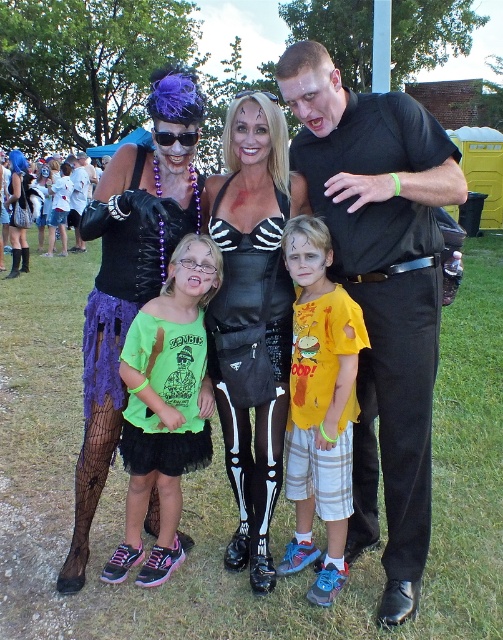
Question: Does neon green t-shirt at center have a greater width compared to yellow cotton shirt at center?

Choices:
 (A) yes
 (B) no

Answer: (A)

Question: Can you confirm if black leather dress at center is positioned below matte purple wig at upper left?

Choices:
 (A) yes
 (B) no

Answer: (A)

Question: Can you confirm if yellow cotton shirt at center is positioned above matte purple wig at upper left?

Choices:
 (A) yes
 (B) no

Answer: (B)

Question: Which point is farther from the camera taking this photo?

Choices:
 (A) (433, 161)
 (B) (176, 468)
 (C) (13, 259)
 (D) (174, 125)

Answer: (C)

Question: Estimate the real-world distances between objects in this image. Which object is farther from the matte black lace gloves at upper left?

Choices:
 (A) black matte shirt at center
 (B) yellow cotton shirt at center

Answer: (A)

Question: Which point is farther from the camera taking this photo?

Choices:
 (A) (41, 211)
 (B) (142, 186)
 (C) (215, 188)

Answer: (A)